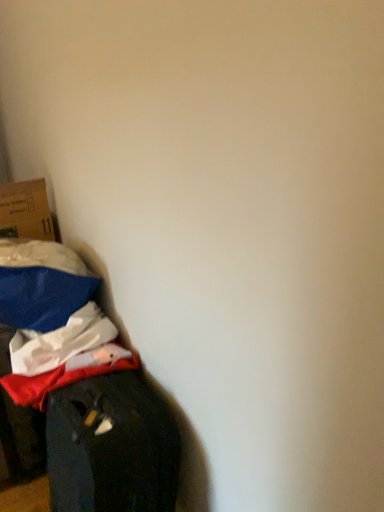
Question: Choose the correct answer: Is cardboard box at left inside velvet-like fabric couch at lower left or outside it?

Choices:
 (A) outside
 (B) inside

Answer: (A)

Question: From the image's perspective, is cardboard box at left above or below velvet-like fabric couch at lower left?

Choices:
 (A) above
 (B) below

Answer: (A)

Question: Would you say cardboard box at left is to the left or to the right of velvet-like fabric couch at lower left in the picture?

Choices:
 (A) left
 (B) right

Answer: (A)

Question: In terms of size, does velvet-like fabric couch at lower left appear bigger or smaller than cardboard box at left?

Choices:
 (A) small
 (B) big

Answer: (B)

Question: Relative to cardboard box at left, is velvet-like fabric couch at lower left in front or behind?

Choices:
 (A) front
 (B) behind

Answer: (A)

Question: Based on their positions, is velvet-like fabric couch at lower left located to the left or right of cardboard box at left?

Choices:
 (A) left
 (B) right

Answer: (B)

Question: From their relative heights in the image, would you say velvet-like fabric couch at lower left is taller or shorter than cardboard box at left?

Choices:
 (A) tall
 (B) short

Answer: (A)